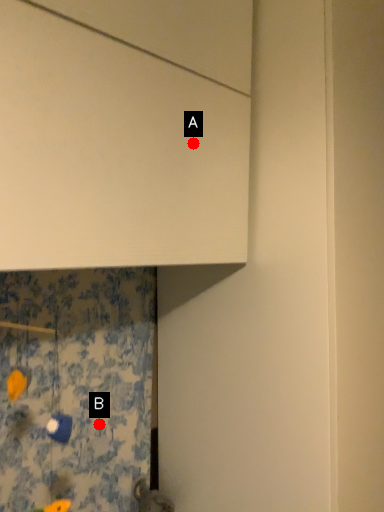
Question: Two points are circled on the image, labeled by A and B beside each circle. Which point is closer to the camera?

Choices:
 (A) A is closer
 (B) B is closer

Answer: (A)